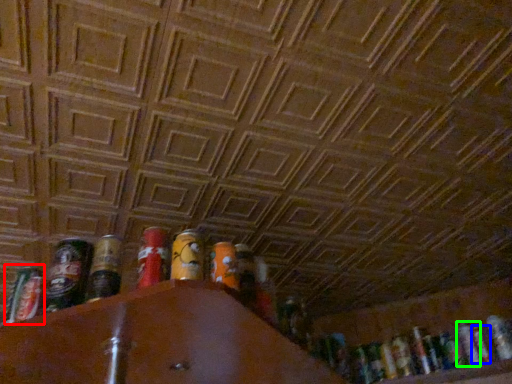
Question: Considering the real-world distances, which object is closest to spray can (highlighted by a red box)? beer (highlighted by a blue box) or beer (highlighted by a green box).

Choices:
 (A) beer
 (B) beer

Answer: (B)